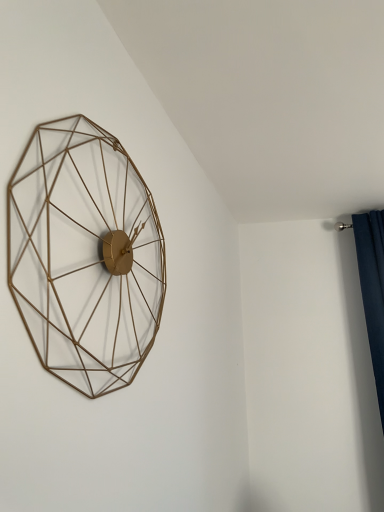
Question: Do you think gold wire wall clock at left is within dark blue fabric at right, or outside of it?

Choices:
 (A) outside
 (B) inside

Answer: (A)

Question: Is gold wire wall clock at left taller or shorter than dark blue fabric at right?

Choices:
 (A) tall
 (B) short

Answer: (B)

Question: Based on their sizes in the image, would you say gold wire wall clock at left is bigger or smaller than dark blue fabric at right?

Choices:
 (A) big
 (B) small

Answer: (B)

Question: In terms of height, does dark blue fabric at right look taller or shorter compared to gold wire wall clock at left?

Choices:
 (A) short
 (B) tall

Answer: (B)

Question: Does point (367, 222) appear closer or farther from the camera than point (72, 273)?

Choices:
 (A) farther
 (B) closer

Answer: (A)

Question: Choose the correct answer: Is dark blue fabric at right inside gold wire wall clock at left or outside it?

Choices:
 (A) outside
 (B) inside

Answer: (A)

Question: Looking at their shapes, would you say dark blue fabric at right is wider or thinner than gold wire wall clock at left?

Choices:
 (A) wide
 (B) thin

Answer: (A)